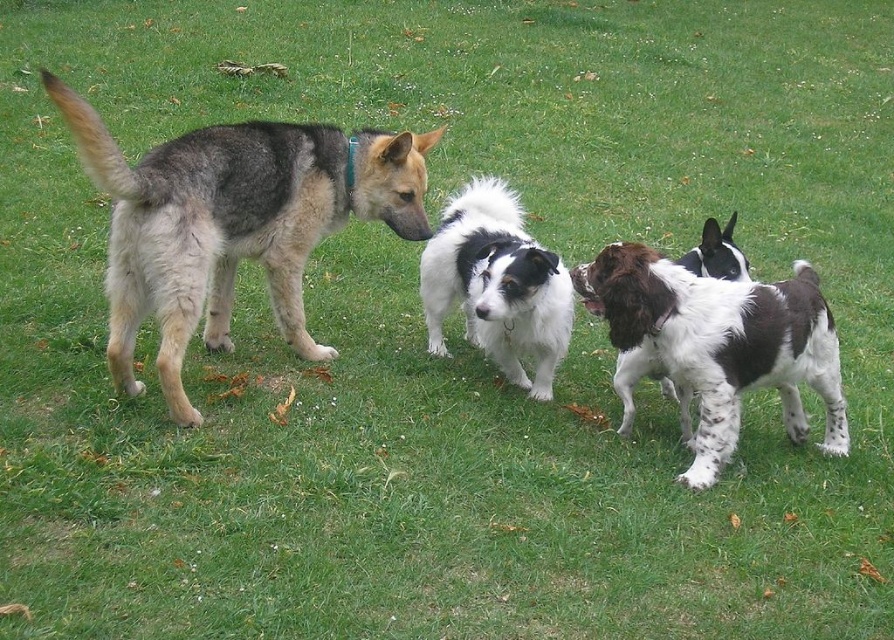
Question: Does white fluffy dog at center appear under white speckled fur dog at center?

Choices:
 (A) yes
 (B) no

Answer: (B)

Question: Does white fluffy dog at center come in front of white speckled fur dog at center?

Choices:
 (A) yes
 (B) no

Answer: (B)

Question: Which of the following is the closest to the observer?

Choices:
 (A) white speckled fur dog at center
 (B) gray-furred dog at left

Answer: (B)

Question: Can you confirm if spotted fur dog at center is positioned above white speckled fur dog at center?

Choices:
 (A) yes
 (B) no

Answer: (A)

Question: Which of these objects is positioned farthest from the white speckled fur dog at center?

Choices:
 (A) spotted fur dog at center
 (B) white fluffy dog at center

Answer: (B)

Question: Estimate the real-world distances between objects in this image. Which object is farther from the white speckled fur dog at center?

Choices:
 (A) white fluffy dog at center
 (B) spotted fur dog at center

Answer: (A)